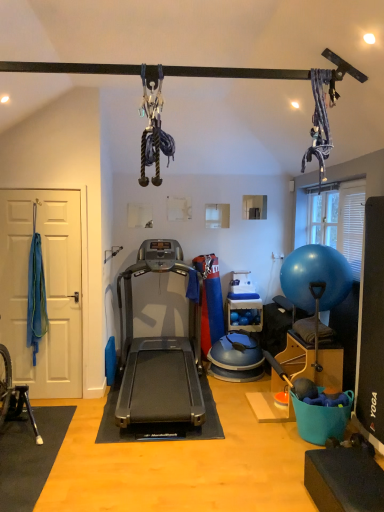
Question: From a real-world perspective, is blue rubber ball at right physically located above or below silver metallic treadmill at center?

Choices:
 (A) above
 (B) below

Answer: (A)

Question: Do you think blue rubber ball at right is within silver metallic treadmill at center, or outside of it?

Choices:
 (A) inside
 (B) outside

Answer: (B)

Question: From the image's perspective, relative to silver metallic treadmill at center, is blue rubber ball at right above or below?

Choices:
 (A) below
 (B) above

Answer: (B)

Question: Is silver metallic treadmill at center in front of or behind blue rubber ball at right in the image?

Choices:
 (A) front
 (B) behind

Answer: (A)

Question: Is silver metallic treadmill at center spatially inside blue rubber ball at right, or outside of it?

Choices:
 (A) inside
 (B) outside

Answer: (B)

Question: In terms of width, does silver metallic treadmill at center look wider or thinner when compared to blue rubber ball at right?

Choices:
 (A) wide
 (B) thin

Answer: (A)

Question: Considering the positions of point (160, 352) and point (329, 266), is point (160, 352) closer or farther from the camera than point (329, 266)?

Choices:
 (A) farther
 (B) closer

Answer: (A)